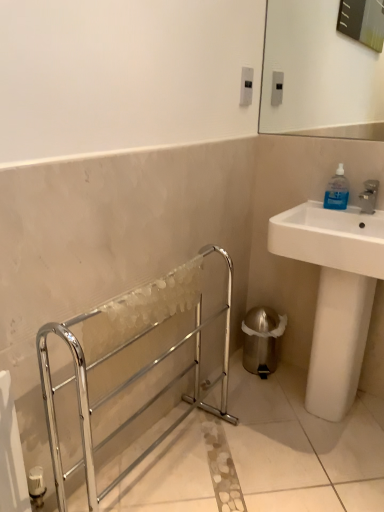
Question: Does white glossy sink at right have a larger size compared to chrome metallic towel rack at left?

Choices:
 (A) no
 (B) yes

Answer: (B)

Question: Is white glossy sink at right at the left side of chrome metallic towel rack at left?

Choices:
 (A) no
 (B) yes

Answer: (A)

Question: Considering the relative sizes of white glossy sink at right and chrome metallic towel rack at left in the image provided, is white glossy sink at right thinner than chrome metallic towel rack at left?

Choices:
 (A) no
 (B) yes

Answer: (A)

Question: Is white glossy sink at right smaller than chrome metallic towel rack at left?

Choices:
 (A) no
 (B) yes

Answer: (A)

Question: Is white glossy sink at right further to the viewer compared to chrome metallic towel rack at left?

Choices:
 (A) yes
 (B) no

Answer: (A)

Question: From the image's perspective, would you say white glossy sink at right is positioned over chrome metallic towel rack at left?

Choices:
 (A) no
 (B) yes

Answer: (B)

Question: Considering the relative sizes of blue translucent bottle at upper right and chrome metallic towel rack at left in the image provided, is blue translucent bottle at upper right shorter than chrome metallic towel rack at left?

Choices:
 (A) yes
 (B) no

Answer: (A)

Question: Is blue translucent bottle at upper right positioned beyond the bounds of chrome metallic towel rack at left?

Choices:
 (A) no
 (B) yes

Answer: (B)

Question: From a real-world perspective, does blue translucent bottle at upper right sit lower than chrome metallic towel rack at left?

Choices:
 (A) yes
 (B) no

Answer: (B)

Question: Would you say chrome metallic towel rack at left is part of blue translucent bottle at upper right's contents?

Choices:
 (A) no
 (B) yes

Answer: (A)

Question: Is blue translucent bottle at upper right facing away from chrome metallic towel rack at left?

Choices:
 (A) no
 (B) yes

Answer: (A)

Question: Is blue translucent bottle at upper right facing towards chrome metallic towel rack at left?

Choices:
 (A) yes
 (B) no

Answer: (B)

Question: From the image's perspective, is blue translucent bottle at upper right under white glossy sink at right?

Choices:
 (A) no
 (B) yes

Answer: (A)